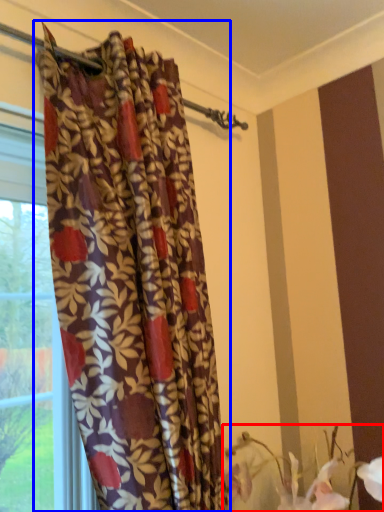
Question: Which object appears farthest to the camera in this image, floral arrangement (highlighted by a red box) or curtain (highlighted by a blue box)?

Choices:
 (A) floral arrangement
 (B) curtain

Answer: (A)